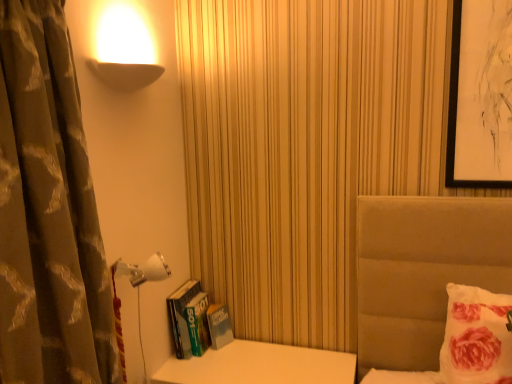
Locate an element on the screen. This screenshot has height=384, width=512. spots to the right of hardcover book at left is located at coordinates (246, 354).